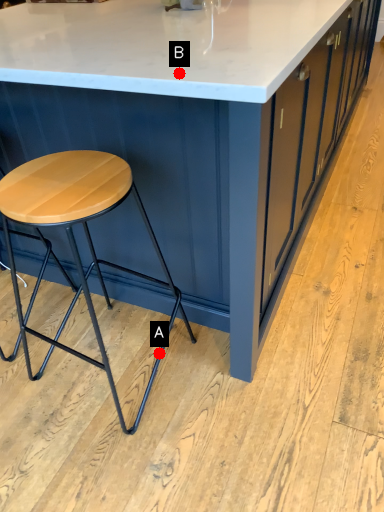
Question: Two points are circled on the image, labeled by A and B beside each circle. Which point is farther from the camera taking this photo?

Choices:
 (A) A is further
 (B) B is further

Answer: (A)